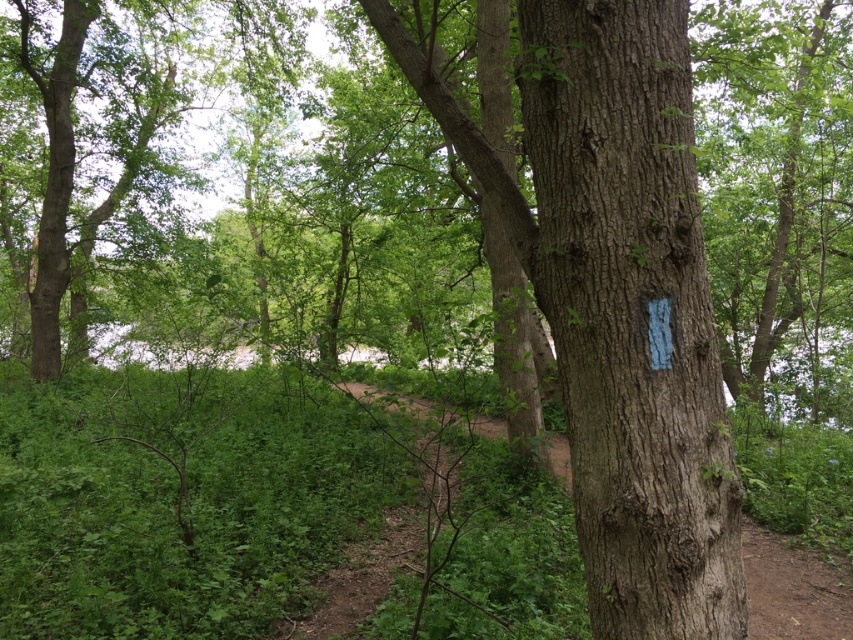
Question: Is smooth bark tree trunk at center above smooth bark tree at center?

Choices:
 (A) yes
 (B) no

Answer: (B)

Question: Among these objects, which one is nearest to the camera?

Choices:
 (A) smooth bark tree at center
 (B) smooth bark tree trunk at center

Answer: (B)

Question: Is the position of smooth bark tree trunk at center less distant than that of smooth bark tree at center?

Choices:
 (A) yes
 (B) no

Answer: (A)

Question: Does smooth bark tree trunk at center have a greater width compared to smooth bark tree at center?

Choices:
 (A) no
 (B) yes

Answer: (A)